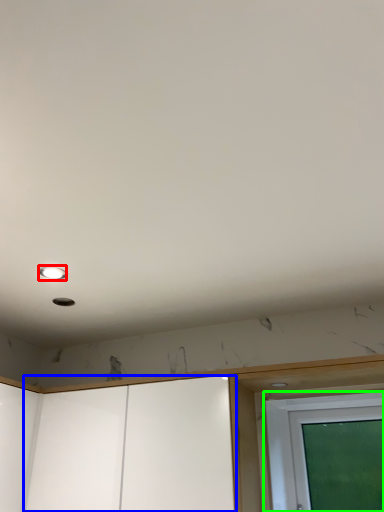
Question: Estimate the real-world distances between objects in this image. Which object is farther from droplight (highlighted by a red box), screen door (highlighted by a blue box) or screen door (highlighted by a green box)?

Choices:
 (A) screen door
 (B) screen door

Answer: (B)